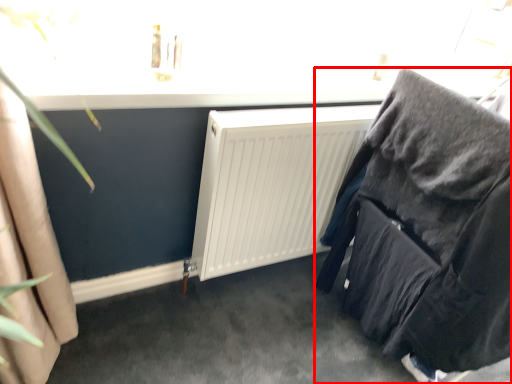
Question: Where is furniture (annotated by the red box) located in relation to radiator in the image?

Choices:
 (A) right
 (B) left

Answer: (A)